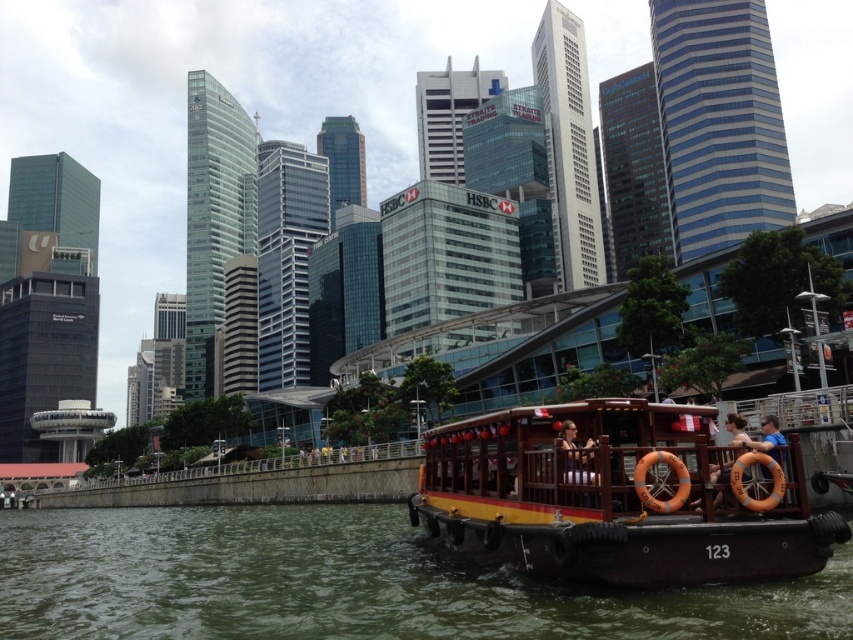
Which is behind, point (480, 573) or point (521, 563)?

The point (480, 573) is behind.

This screenshot has width=853, height=640. I want to click on greenish water at lower left, so click(x=345, y=582).